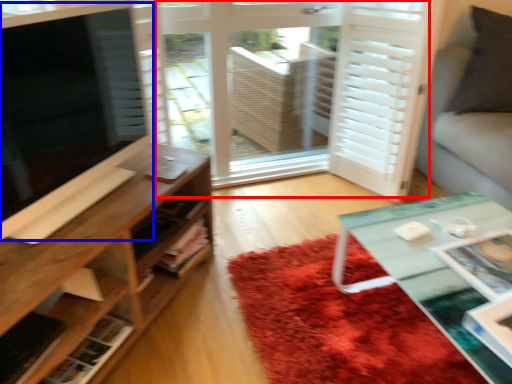
Question: Which object is closer to the camera taking this photo, screen door (highlighted by a red box) or window screen (highlighted by a blue box)?

Choices:
 (A) screen door
 (B) window screen

Answer: (B)